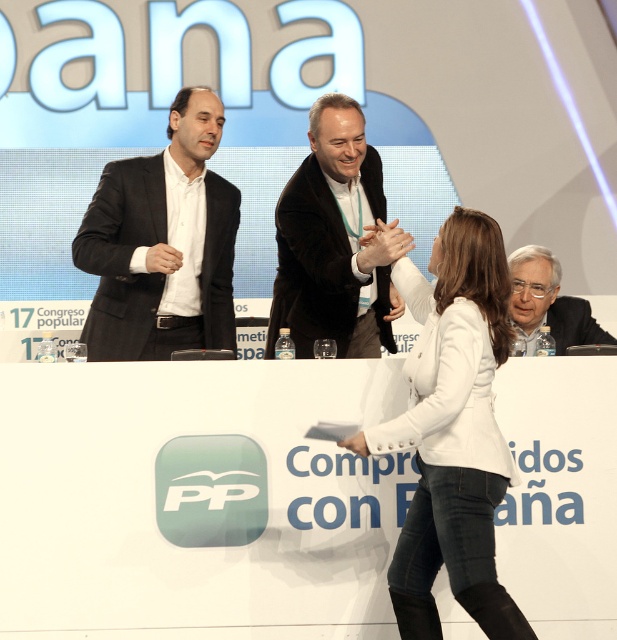
Please describe the location of the black matte suit at left in the image using coordinates.

The black matte suit at left is located at coordinates point (157, 243).

You are a photographer at the event and need to capture a closeup shot of the white leather jacket at center and the matte black hand at center. The camera you are using has a minimum focusing distance of 50 centimeters. Will you be able to take the photo without moving closer?

The distance between the white leather jacket at center and the matte black hand at center is 60.27 centimeters, which is greater than the camera minimum focusing distance of 50 centimeters. Therefore, you can take the photo without moving closer.